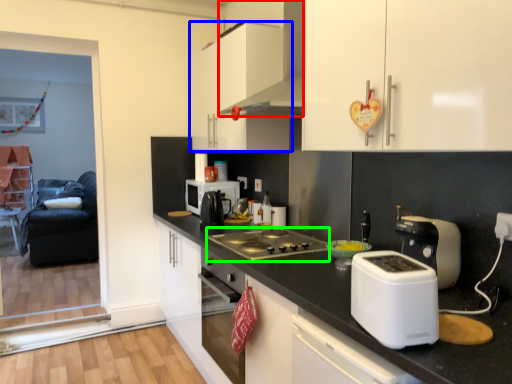
Question: Which is nearer to the home appliance (highlighted by a red box)? cabinetry (highlighted by a blue box) or gas stove (highlighted by a green box).

Choices:
 (A) cabinetry
 (B) gas stove

Answer: (A)